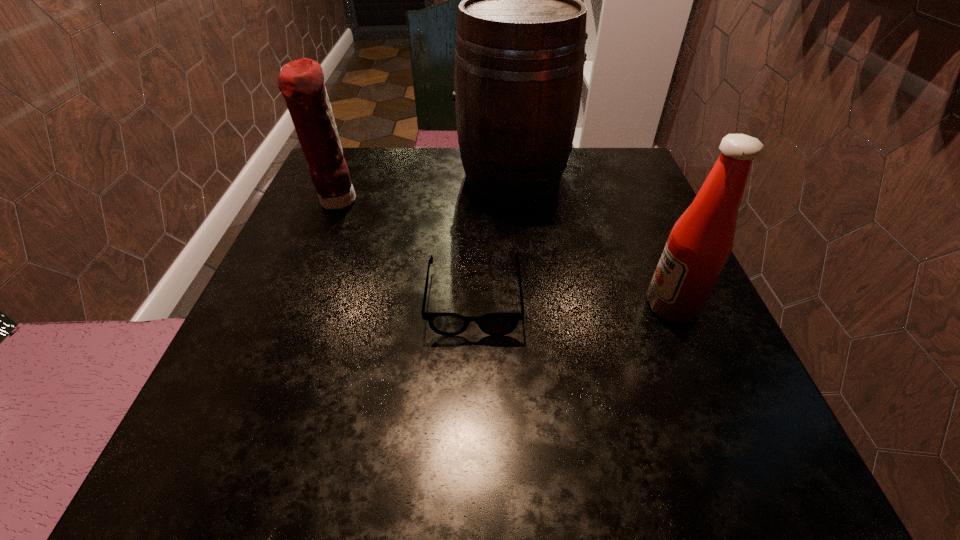
What are the coordinates of `empty space between the cider and the right condiment` in the screenshot? It's located at (592, 241).

Where is `blank region between the nearer condiment and the spectacles`? blank region between the nearer condiment and the spectacles is located at coordinates (573, 302).

Locate an element on the screen. The height and width of the screenshot is (540, 960). free point between the cider and the left condiment is located at coordinates (424, 188).

Where is `unoccupied area between the cider and the spectacles`? This screenshot has width=960, height=540. unoccupied area between the cider and the spectacles is located at coordinates click(x=493, y=237).

Locate which object ranks third in proximity to the spectacles. Please provide its 2D coordinates. Your answer should be formatted as a tuple, i.e. [(x, y)], where the tuple contains the x and y coordinates of a point satisfying the conditions above.

[(301, 82)]

Choose which object is the second nearest neighbor to the shortest object. Please provide its 2D coordinates. Your answer should be formatted as a tuple, i.e. [(x, y)], where the tuple contains the x and y coordinates of a point satisfying the conditions above.

[(698, 246)]

Identify the location of vacant area in the image that satisfies the following two spatial constraints: 1. on the side of the tallest object near the bung hole; 2. on the arms of the shortest object. This screenshot has height=540, width=960. [524, 299].